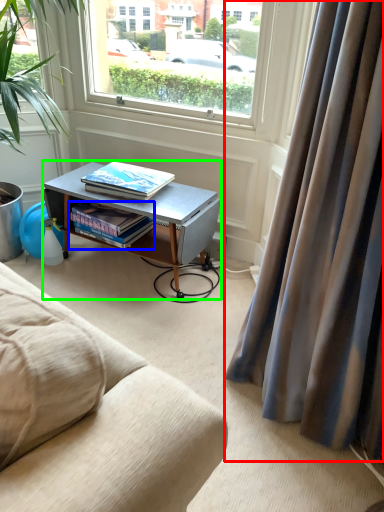
Question: Which is nearer to the curtain (highlighted by a red box)? book (highlighted by a blue box) or desk (highlighted by a green box).

Choices:
 (A) book
 (B) desk

Answer: (B)